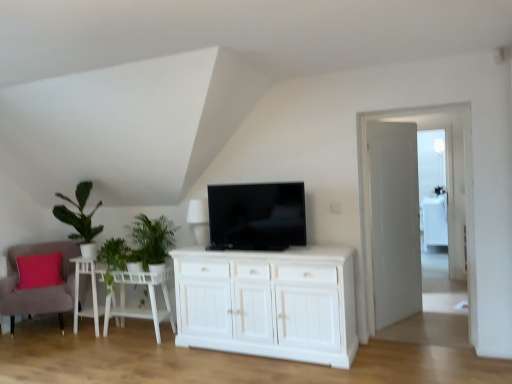
Question: Is green leafy plant at left aimed at green leafy plant at left, positioned as the 2th plant in right-to-left order?

Choices:
 (A) yes
 (B) no

Answer: (B)

Question: From the image's perspective, does green leafy plant at left appear lower than green leafy plant at left, the first plant from the left?

Choices:
 (A) yes
 (B) no

Answer: (B)

Question: From a real-world perspective, is green leafy plant at left below green leafy plant at left, the first plant from the left?

Choices:
 (A) no
 (B) yes

Answer: (A)

Question: From a real-world perspective, is green leafy plant at left physically above green leafy plant at left, positioned as the 2th plant in right-to-left order?

Choices:
 (A) no
 (B) yes

Answer: (B)

Question: Can you confirm if green leafy plant at left is taller than green leafy plant at left, positioned as the 2th plant in right-to-left order?

Choices:
 (A) yes
 (B) no

Answer: (A)

Question: Does green leafy plant at left come behind green leafy plant at left, positioned as the 2th plant in right-to-left order?

Choices:
 (A) yes
 (B) no

Answer: (B)

Question: Can you confirm if green leafy plant at left, positioned as the 2th plant in right-to-left order, is thinner than transparent glass door at right, arranged as the 2th glass door when viewed from the back?

Choices:
 (A) no
 (B) yes

Answer: (A)

Question: Is the position of green leafy plant at left, positioned as the 2th plant in right-to-left order, more distant than that of transparent glass door at right, arranged as the 2th glass door when viewed from the back?

Choices:
 (A) no
 (B) yes

Answer: (B)

Question: From the image's perspective, is green leafy plant at left, positioned as the 2th plant in right-to-left order, beneath transparent glass door at right, the second glass door in the right-to-left sequence?

Choices:
 (A) no
 (B) yes

Answer: (B)

Question: From a real-world perspective, is green leafy plant at left, the first plant from the left, positioned under transparent glass door at right, the first glass door viewed from the front, based on gravity?

Choices:
 (A) no
 (B) yes

Answer: (B)

Question: Can you confirm if green leafy plant at left, the first plant from the left, is positioned to the right of transparent glass door at right, which is counted as the 1th glass door, starting from the left?

Choices:
 (A) no
 (B) yes

Answer: (A)

Question: Would you say green leafy plant at left, the first plant from the left, is outside transparent glass door at right, which is counted as the 1th glass door, starting from the left?

Choices:
 (A) yes
 (B) no

Answer: (A)

Question: Are velvet pink armchair at lower left and green leafy plant at left, positioned as the 2th plant in right-to-left order, beside each other?

Choices:
 (A) no
 (B) yes

Answer: (A)